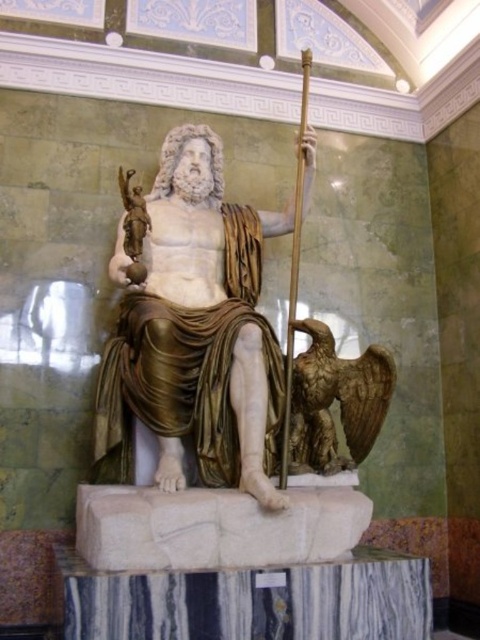
Which is more to the right, white marble statue at center or bronze eagle at lower right?

bronze eagle at lower right

Who is higher up, white marble statue at center or bronze eagle at lower right?

Positioned higher is white marble statue at center.

Which is behind, point (196, 145) or point (294, 444)?

Point (196, 145)

Find the location of a particular element. This screenshot has width=480, height=640. white marble statue at center is located at coordinates (195, 336).